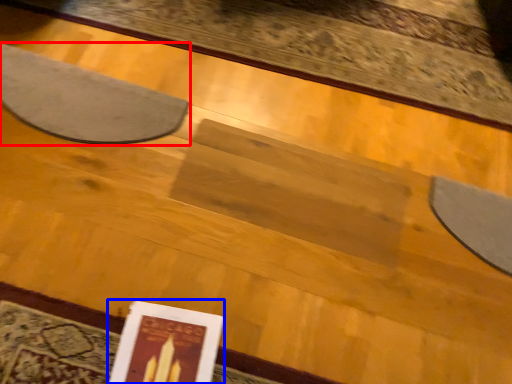
Question: Which object appears closest to the camera in this image, mat (highlighted by a red box) or paperback book (highlighted by a blue box)?

Choices:
 (A) mat
 (B) paperback book

Answer: (B)